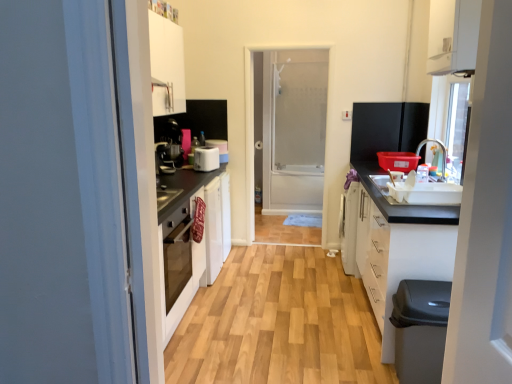
The width and height of the screenshot is (512, 384). What are the coordinates of `free space above wooden floor at center (from a real-world perspective)` in the screenshot? It's located at (285, 299).